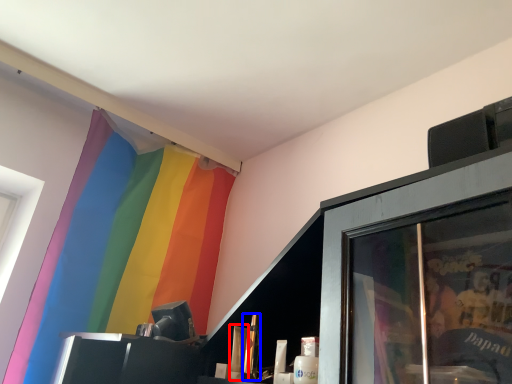
Question: Which point is closer to the camera, toiletry (highlighted by a red box) or toiletry (highlighted by a blue box)?

Choices:
 (A) toiletry
 (B) toiletry

Answer: (B)